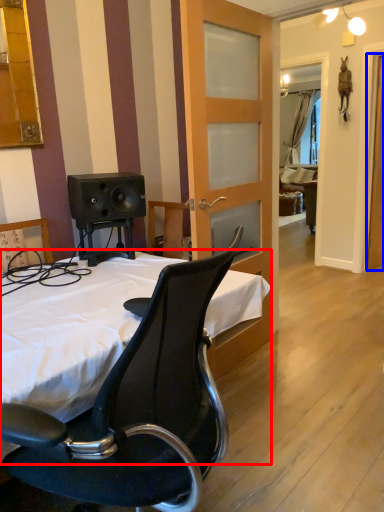
Question: Which point is closer to the camera, bed (highlighted by a red box) or screen door (highlighted by a blue box)?

Choices:
 (A) bed
 (B) screen door

Answer: (A)